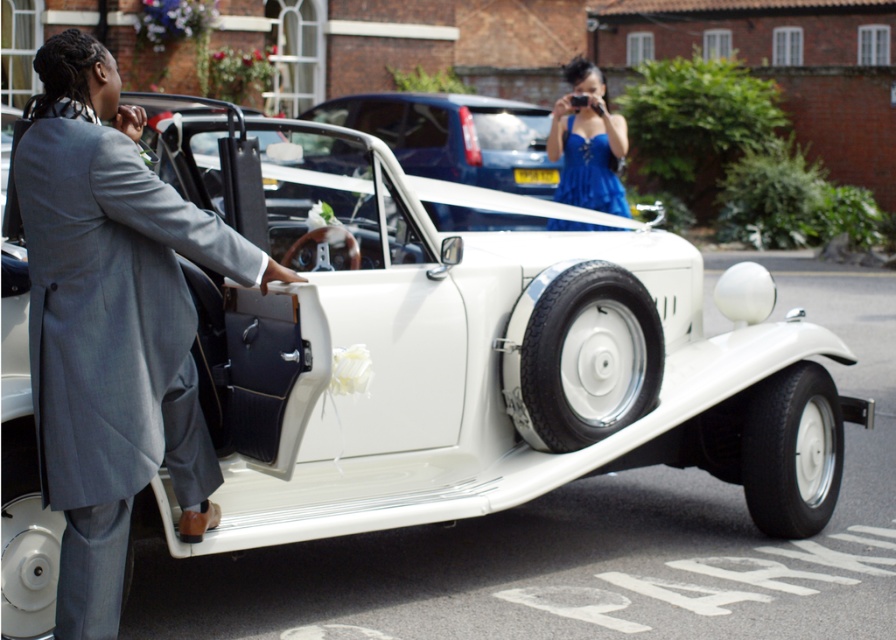
Question: Does gray wool suit at left have a greater width compared to blue satin dress at upper center?

Choices:
 (A) no
 (B) yes

Answer: (A)

Question: Is gray wool suit at left to the left of blue satin dress at upper center from the viewer's perspective?

Choices:
 (A) no
 (B) yes

Answer: (B)

Question: Is gray wool suit at left further to camera compared to blue satin dress at upper center?

Choices:
 (A) no
 (B) yes

Answer: (A)

Question: Which point is farther from the camera taking this photo?

Choices:
 (A) (567, 120)
 (B) (181, 211)

Answer: (A)